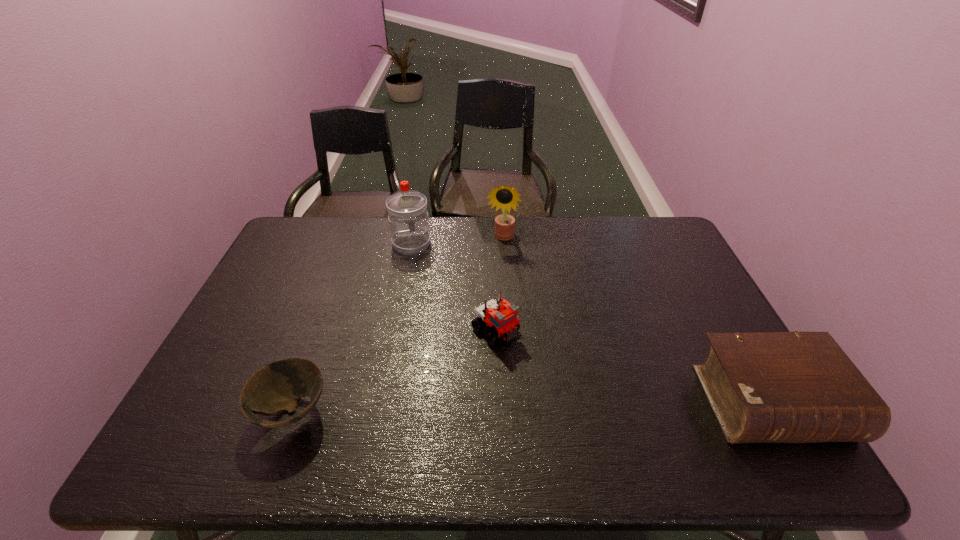
At what (x,y) coordinates should I click in order to perform the action: click on the leftmost object. Please return your answer as a coordinate pair (x, y). This screenshot has width=960, height=540. Looking at the image, I should click on (278, 386).

Identify the location of bowl. Image resolution: width=960 pixels, height=540 pixels. (278, 386).

Find the location of a particular element. The height and width of the screenshot is (540, 960). the rightmost object is located at coordinates (764, 387).

Identify the location of the third nearest object. Image resolution: width=960 pixels, height=540 pixels. pyautogui.click(x=501, y=317).

Find the location of a particular element. The height and width of the screenshot is (540, 960). sunflower is located at coordinates (504, 197).

The width and height of the screenshot is (960, 540). I want to click on the fourth object from right to left, so click(x=407, y=209).

The image size is (960, 540). Find the location of `blank area located 0.180m on the back of the bowl`. blank area located 0.180m on the back of the bowl is located at coordinates (324, 326).

Identify the location of free region located on the front-facing side of the Lego. Image resolution: width=960 pixels, height=540 pixels. (527, 358).

Find the location of a particular element. The height and width of the screenshot is (540, 960). vacant space located on the front-facing side of the Lego is located at coordinates (577, 402).

At what (x,y) coordinates should I click in order to perform the action: click on vacant space located on the front-facing side of the Lego. Please return your answer as a coordinate pair (x, y). Looking at the image, I should click on (555, 383).